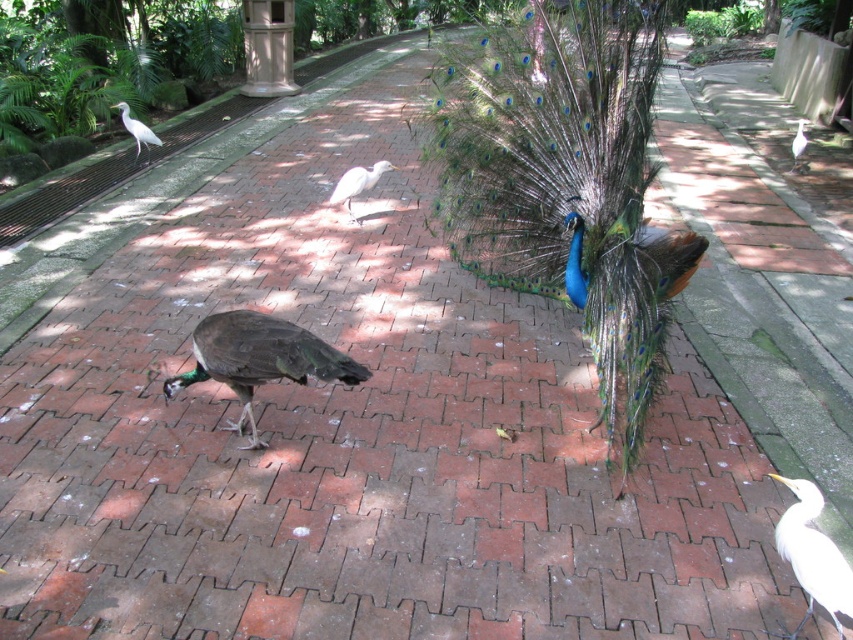
Who is shorter, shiny green peacock at center or white feathered bird at upper left?

shiny green peacock at center

Identify the location of shiny green peacock at center. Image resolution: width=853 pixels, height=640 pixels. click(x=259, y=358).

Is point (260, 330) positioned before point (125, 113)?

That is True.

Where is `shiny green peacock at center`? This screenshot has width=853, height=640. shiny green peacock at center is located at coordinates (259, 358).

Which is more to the right, shiny blue peacock at center or white feathered bird at upper right?

white feathered bird at upper right

Can you confirm if shiny blue peacock at center is shorter than white feathered bird at upper right?

In fact, shiny blue peacock at center may be taller than white feathered bird at upper right.

Is point (643, 77) positioned behind point (798, 154)?

No, it is not.

I want to click on shiny blue peacock at center, so click(566, 180).

Is shiny green peacock at center in front of white matte bird at lower right?

No, it is not.

Does shiny green peacock at center lie behind white matte bird at lower right?

Yes, it is.

Between point (234, 428) and point (842, 563), which one is positioned behind?

Positioned behind is point (234, 428).

The height and width of the screenshot is (640, 853). Identify the location of shiny green peacock at center. (259, 358).